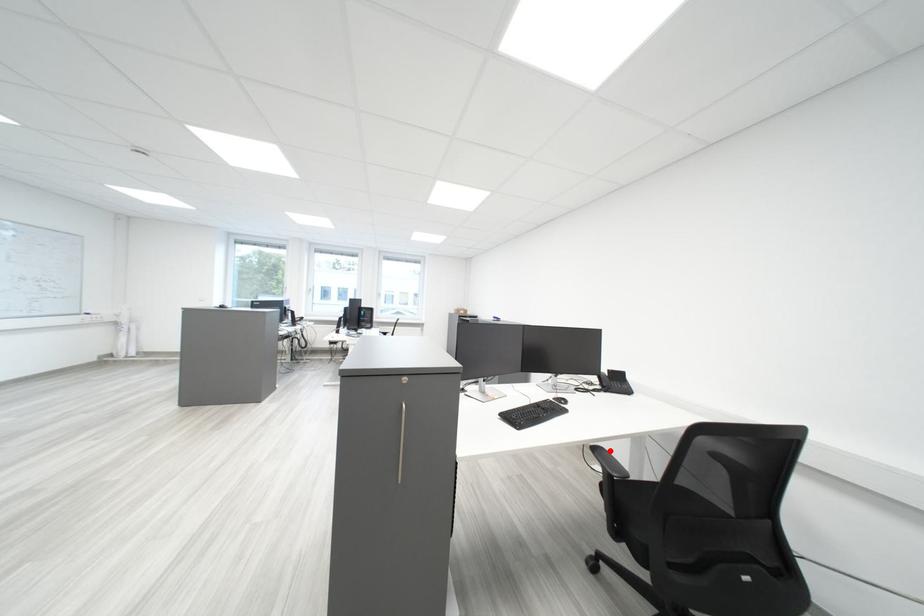
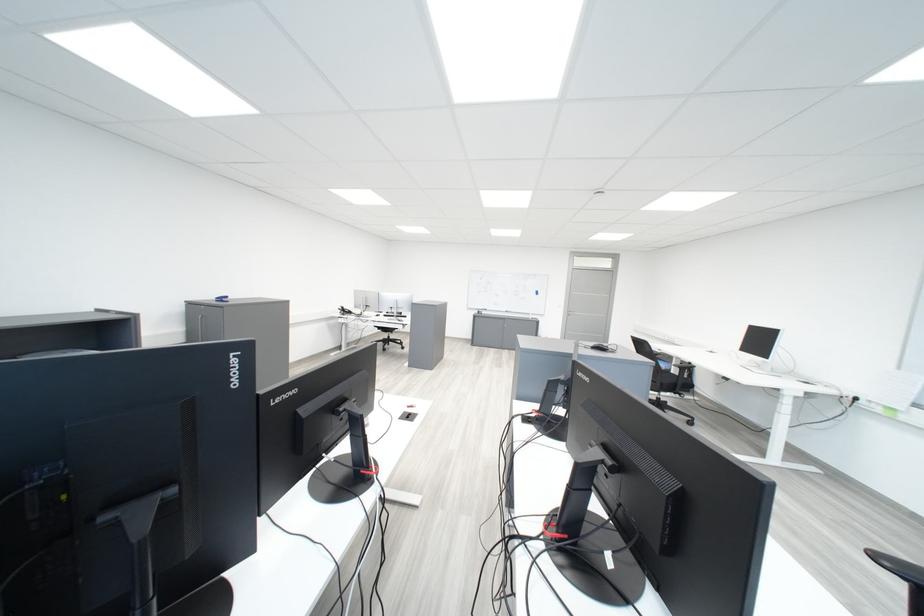
Question: I am providing you with two images of the same scene from different viewpoints. A red point is marked on the first image. Can you still see the location of the red point in image 2?

Choices:
 (A) Yes
 (B) No

Answer: (B)